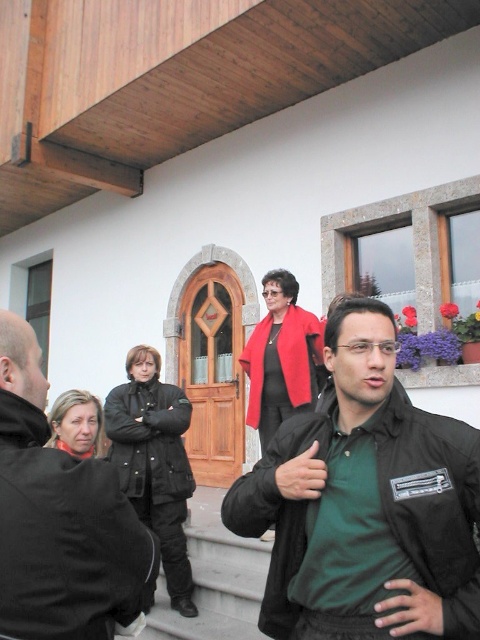
In the scene shown: You are standing in front of the building and see the wooden door with a semi circular top and a small window framed by a stone archway. There is a person wearing a black matte jacket at lower right represented by point (432,502). Can you tell me where the black matte jacket at lower right is located relative to the wooden door with a semi circular top and a small window framed by a stone archway?

The black matte jacket at lower right represented by point (432,502) is located near the wooden door with a semi circular top and a small window framed by a stone archway.

You are a photographer setting up a shot of the scene. You need to ensure both the dark green textured jacket at center and the matte red jacket at center are visible in the frame. Based on their positions, which jacket should you focus on first to capture both in the shot?

The dark green textured jacket at center is below the matte red jacket at center, so focusing on the matte red jacket at center first will ensure both are in the frame as the dark green one is positioned lower.

In the scene shown: You are a photographer trying to capture both the black matte jacket at lower right and the dark green textured jacket at center in a single frame. Considering their sizes, which jacket will appear larger in the photo?

The black matte jacket at lower right will appear larger in the photo because it is bigger than the dark green textured jacket at center.